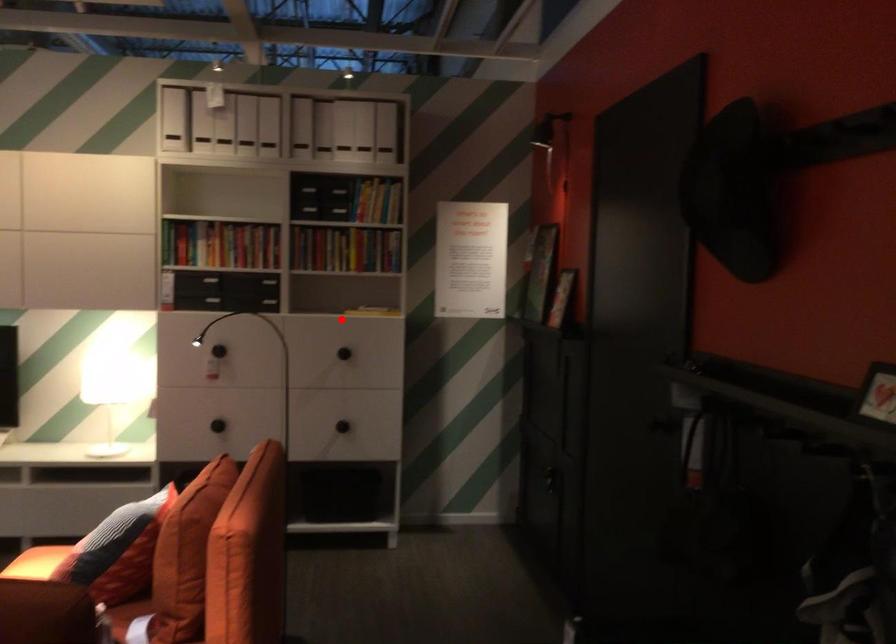
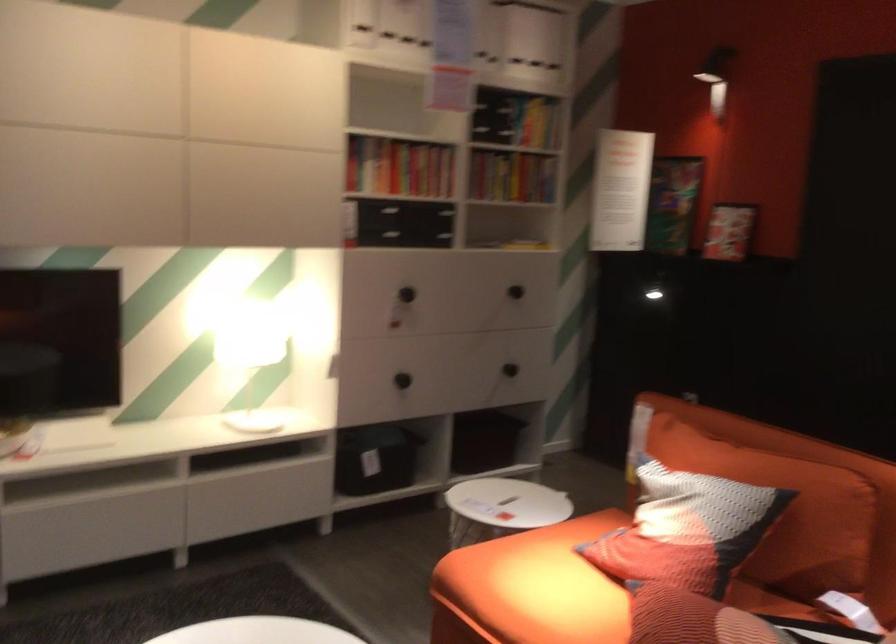
Find the pixel in the second image that matches the highlighted location in the first image.

(524, 245)